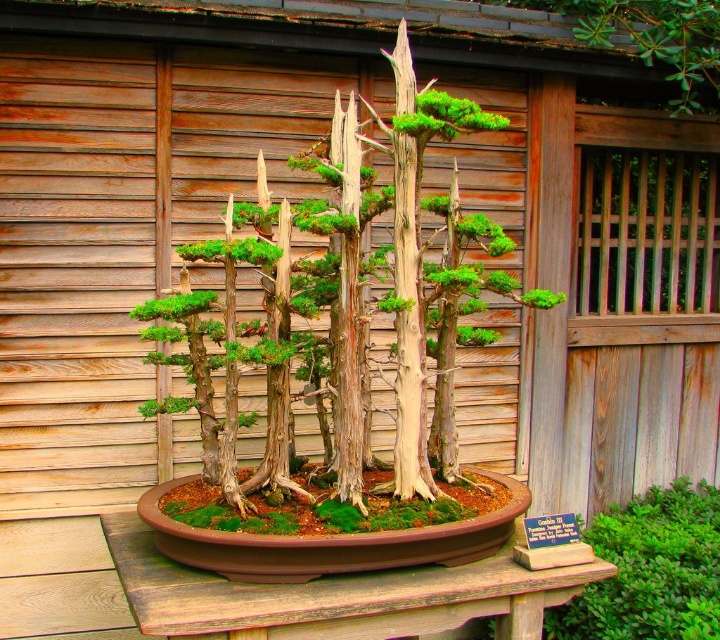
Who is shorter, green textured bonsai at center or brown wooden table at center?

brown wooden table at center

Does green textured bonsai at center have a greater height compared to brown wooden table at center?

Yes.

Does point (397, 65) come behind point (464, 589)?

Yes, it is.

Identify the location of green textured bonsai at center. This screenshot has height=640, width=720. (350, 300).